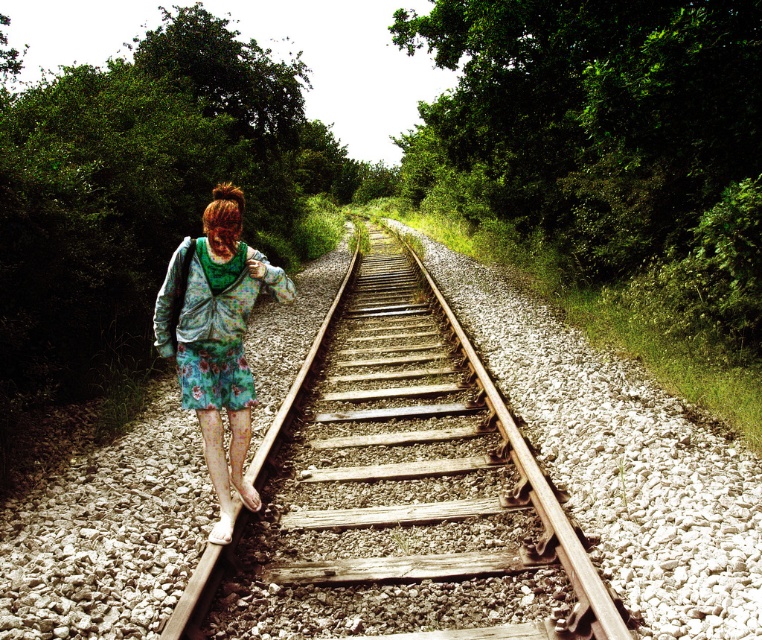
Who is positioned more to the left, wooden track at center or floral fabric dress at center?

floral fabric dress at center

Is wooden track at center smaller than floral fabric dress at center?

Actually, wooden track at center might be larger than floral fabric dress at center.

Is point (421, 273) positioned behind point (210, 397)?

Yes, point (421, 273) is farther from viewer.

I want to click on wooden track at center, so click(x=399, y=490).

Can you confirm if floral fabric skirt at center is bigger than floral fabric dress at center?

Indeed, floral fabric skirt at center has a larger size compared to floral fabric dress at center.

Who is more forward, (219, 481) or (239, 320)?

Point (219, 481)

Based on the photo, who is more distant from viewer, (187, 266) or (215, 314)?

Point (215, 314)

Image resolution: width=762 pixels, height=640 pixels. I want to click on floral fabric skirt at center, so click(x=216, y=339).

Does wooden track at center appear over floral fabric skirt at center?

Incorrect, wooden track at center is not positioned above floral fabric skirt at center.

Can you confirm if wooden track at center is bigger than floral fabric skirt at center?

Yes, wooden track at center is bigger than floral fabric skirt at center.

Is point (274, 444) positioned behind point (157, 340)?

Yes, point (274, 444) is farther from viewer.

Locate an element on the screen. The width and height of the screenshot is (762, 640). wooden track at center is located at coordinates (399, 490).